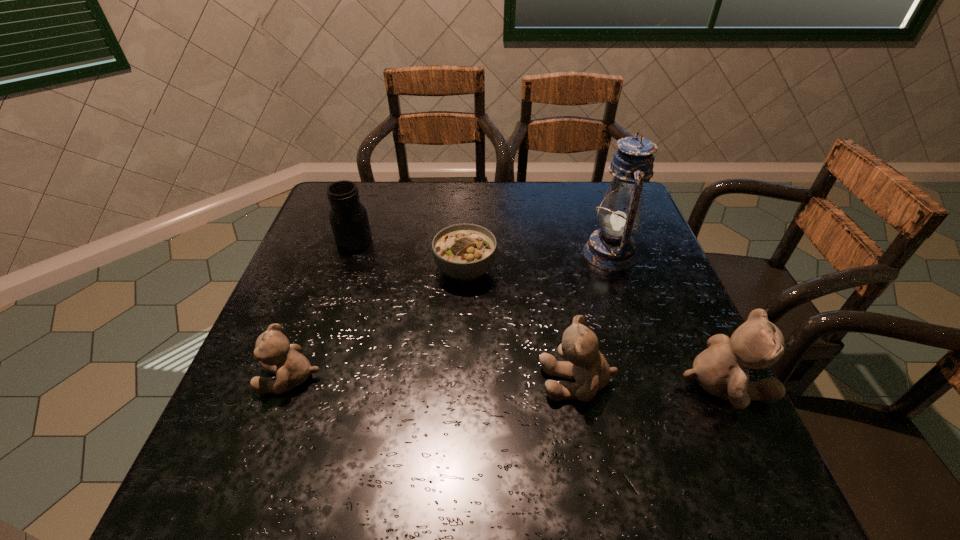
Identify which teddy bear is the nearest to the leftmost teddy bear. Please provide its 2D coordinates. Your answer should be formatted as a tuple, i.e. [(x, y)], where the tuple contains the x and y coordinates of a point satisfying the conditions above.

[(585, 364)]